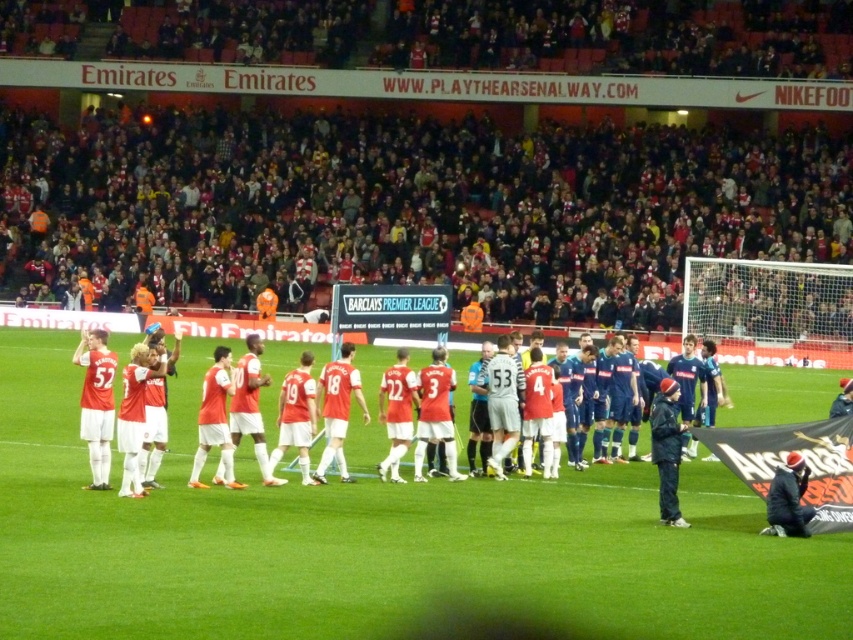
Question: Estimate the real-world distances between objects in this image. Which object is closer to the matte red jersey at center?

Choices:
 (A) green grass field at center
 (B) dark blue jacket at center

Answer: (B)

Question: Which object appears closest to the camera in this image?

Choices:
 (A) matte red jersey at center
 (B) dark blue jacket at center
 (C) green grass field at center

Answer: (C)

Question: Can you confirm if green grass field at center is positioned above dark blue jacket at center?

Choices:
 (A) yes
 (B) no

Answer: (B)

Question: Among these objects, which one is farthest from the camera?

Choices:
 (A) green grass field at center
 (B) matte red jersey at center

Answer: (B)

Question: Is matte red jersey at center bigger than dark blue jacket at center?

Choices:
 (A) no
 (B) yes

Answer: (A)

Question: Does green grass field at center appear on the right side of matte red jersey at center?

Choices:
 (A) yes
 (B) no

Answer: (A)